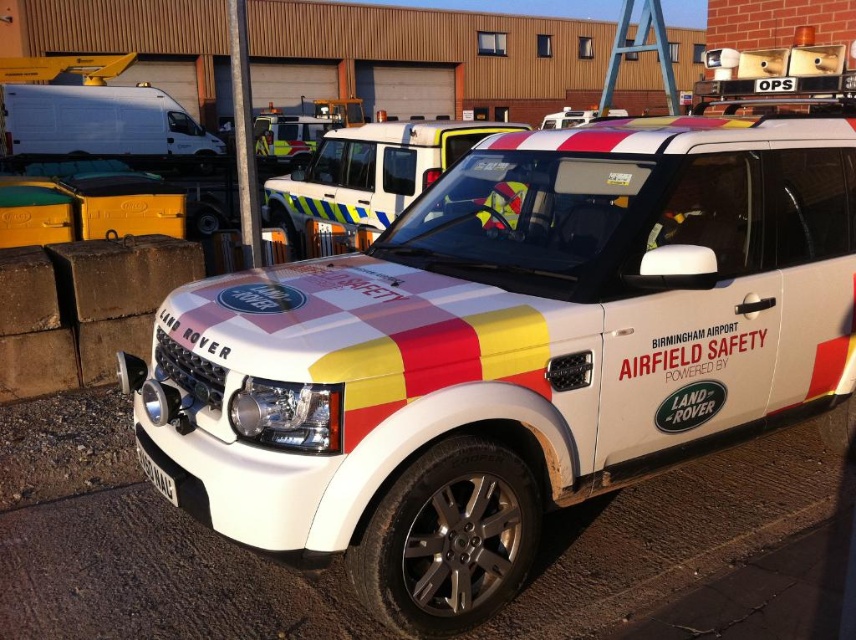
Between white glossy suv at center and black plastic license plate at lower center, which one has less height?

black plastic license plate at lower center

Based on the photo, between white glossy suv at center and black plastic license plate at lower center, which one appears on the right side from the viewer's perspective?

Positioned to the right is white glossy suv at center.

Describe the element at coordinates (510, 352) in the screenshot. I see `white glossy suv at center` at that location.

Where is `white glossy suv at center`? white glossy suv at center is located at coordinates (510, 352).

Who is shorter, matte white vehicle at center or black plastic license plate at lower center?

Standing shorter between the two is black plastic license plate at lower center.

Is point (424, 138) farther from camera compared to point (150, 468)?

Yes, it is behind point (150, 468).

Locate an element on the screen. This screenshot has height=640, width=856. matte white vehicle at center is located at coordinates (369, 172).

In the scene shown: Is yellow reflective safety vest at center to the left of black plastic license plate at lower center from the viewer's perspective?

Indeed, yellow reflective safety vest at center is positioned on the left side of black plastic license plate at lower center.

Could you measure the distance between yellow reflective safety vest at center and black plastic license plate at lower center?

23.01 meters

This screenshot has height=640, width=856. Identify the location of yellow reflective safety vest at center. pyautogui.click(x=301, y=128).